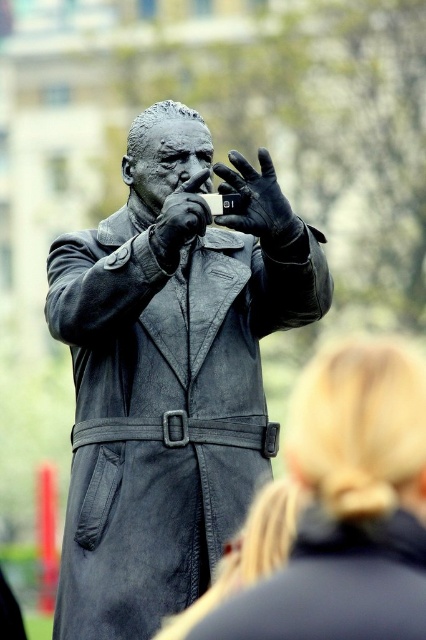
Is point (181, 134) less distant than point (163, 232)?

No.

Can you confirm if bronze statue at center is taller than polished bronze hand at center?

Yes.

Measure the distance between point [212,420] and camera.

Point [212,420] and camera are 67.87 meters apart from each other.

What are the coordinates of `bronze statue at center` in the screenshot? It's located at (164, 387).

Can you confirm if black leather glove at center is smaller than polished bronze hand at center?

Incorrect, black leather glove at center is not smaller in size than polished bronze hand at center.

Is black leather glove at center taller than polished bronze hand at center?

Indeed, black leather glove at center has a greater height compared to polished bronze hand at center.

Locate an element on the screen. Image resolution: width=426 pixels, height=640 pixels. black leather glove at center is located at coordinates (256, 200).

The height and width of the screenshot is (640, 426). I want to click on black leather glove at center, so click(256, 200).

Who is more distant from viewer, (267, 432) or (218, 184)?

Positioned behind is point (267, 432).

Where is `bronze statue at center`? bronze statue at center is located at coordinates (164, 387).